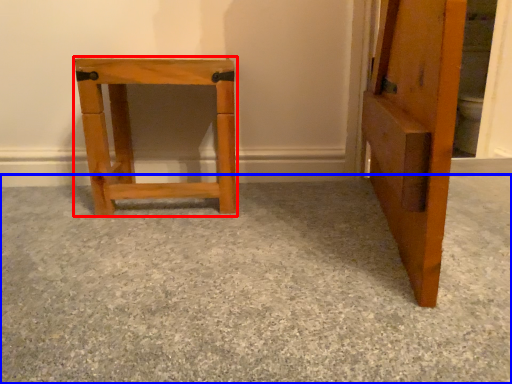
Question: Which object appears closest to the camera in this image, furniture (highlighted by a red box) or concrete (highlighted by a blue box)?

Choices:
 (A) furniture
 (B) concrete

Answer: (B)